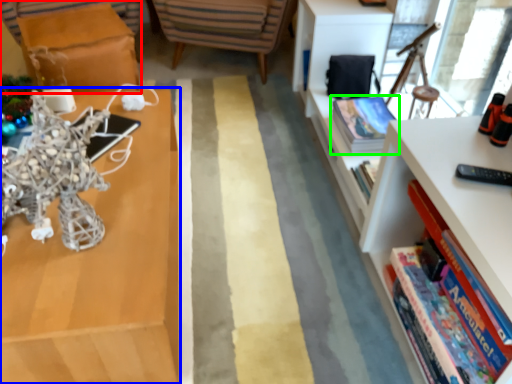
Question: Which object is the closest to the table (highlighted by a red box)? Choose among these: shelf (highlighted by a blue box) or book (highlighted by a green box).

Choices:
 (A) shelf
 (B) book

Answer: (A)